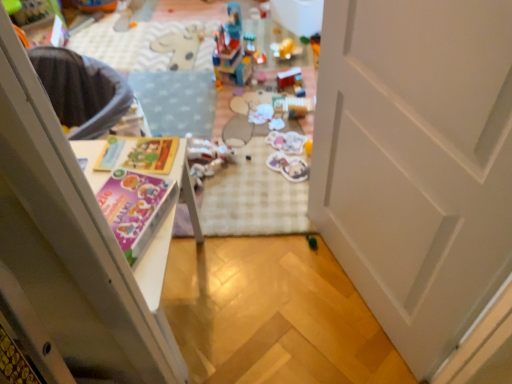
Question: Does matte paper magazine at center appear on the right side of translucent plastic toy at center, placed as the 4th toy when sorted from top to bottom?

Choices:
 (A) no
 (B) yes

Answer: (A)

Question: From the image's perspective, is matte paper magazine at center below translucent plastic toy at center, placed as the third toy when sorted from bottom to top?

Choices:
 (A) yes
 (B) no

Answer: (A)

Question: Does matte paper magazine at center have a lesser width compared to translucent plastic toy at center, placed as the third toy when sorted from bottom to top?

Choices:
 (A) yes
 (B) no

Answer: (A)

Question: Is matte paper magazine at center positioned in front of translucent plastic toy at center, placed as the third toy when sorted from bottom to top?

Choices:
 (A) no
 (B) yes

Answer: (B)

Question: Could you tell me if matte paper magazine at center is turned towards translucent plastic toy at center, placed as the third toy when sorted from bottom to top?

Choices:
 (A) yes
 (B) no

Answer: (B)

Question: Is the depth of matte paper magazine at center greater than that of translucent plastic toy at center, placed as the 4th toy when sorted from top to bottom?

Choices:
 (A) no
 (B) yes

Answer: (A)

Question: Considering the relative positions of white matte door at center and matte purple book at left in the image provided, is white matte door at center behind matte purple book at left?

Choices:
 (A) no
 (B) yes

Answer: (A)

Question: Considering the relative sizes of white matte door at center and matte purple book at left in the image provided, is white matte door at center bigger than matte purple book at left?

Choices:
 (A) no
 (B) yes

Answer: (B)

Question: Considering the relative positions of white matte door at center and matte purple book at left in the image provided, is white matte door at center to the left of matte purple book at left from the viewer's perspective?

Choices:
 (A) no
 (B) yes

Answer: (A)

Question: Considering the relative sizes of white matte door at center and matte purple book at left in the image provided, is white matte door at center shorter than matte purple book at left?

Choices:
 (A) no
 (B) yes

Answer: (A)

Question: Is white matte door at center facing away from matte purple book at left?

Choices:
 (A) no
 (B) yes

Answer: (A)

Question: From the image's perspective, is white matte door at center above matte purple book at left?

Choices:
 (A) no
 (B) yes

Answer: (B)

Question: Can you confirm if translucent plastic stickers at center, arranged as the third toy when viewed from the top, is taller than matte plastic stickers at center, which ranks as the fifth toy in top-to-bottom order?

Choices:
 (A) no
 (B) yes

Answer: (A)